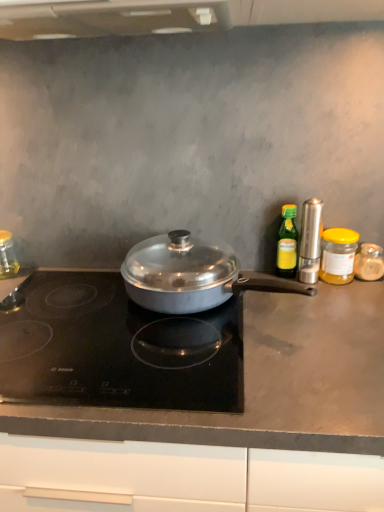
The width and height of the screenshot is (384, 512). Find the location of `vacant area that lies between satin silver pan at center, the 2th kitchen appliance from the left, and yellow glass jar at right, arranged as the fifth kitchen appliance when viewed from the left`. vacant area that lies between satin silver pan at center, the 2th kitchen appliance from the left, and yellow glass jar at right, arranged as the fifth kitchen appliance when viewed from the left is located at coordinates (330, 304).